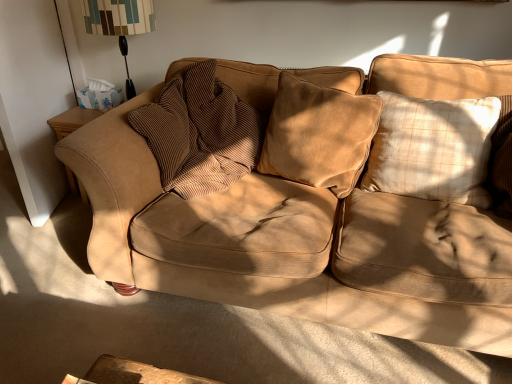
Question: Considering the positions of beige plaid pillow at right, placed as the third pillow when sorted from left to right, and patterned fabric lampshade at upper left in the image, is beige plaid pillow at right, placed as the third pillow when sorted from left to right, bigger or smaller than patterned fabric lampshade at upper left?

Choices:
 (A) small
 (B) big

Answer: (A)

Question: From a real-world perspective, relative to patterned fabric lampshade at upper left, is beige plaid pillow at right, placed as the 1th pillow when sorted from right to left, vertically above or below?

Choices:
 (A) above
 (B) below

Answer: (B)

Question: Considering the real-world distances, which object is farthest from the velvet brown pillow at center, arranged as the 2th pillow when viewed from the left?

Choices:
 (A) brown corduroy pillow at center, the 1th pillow viewed from the left
 (B) patterned fabric lampshade at upper left
 (C) suede couch at center
 (D) beige plaid pillow at right, placed as the 1th pillow when sorted from right to left

Answer: (B)

Question: Estimate the real-world distances between objects in this image. Which object is farther from the beige plaid pillow at right, placed as the 1th pillow when sorted from right to left?

Choices:
 (A) patterned fabric lampshade at upper left
 (B) velvet brown pillow at center, arranged as the 2th pillow when viewed from the left
 (C) brown corduroy pillow at center, positioned as the third pillow in right-to-left order
 (D) suede couch at center

Answer: (A)